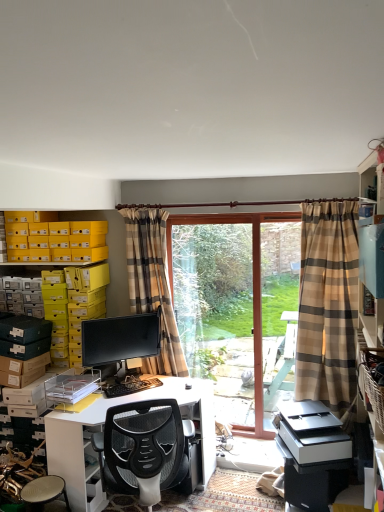
At what (x,y) coordinates should I click in order to perform the action: click on vacant space underneath black plastic keyboard at center (from a real-world perspective). Please return your answer as a coordinate pair (x, y). Looking at the image, I should click on (135, 387).